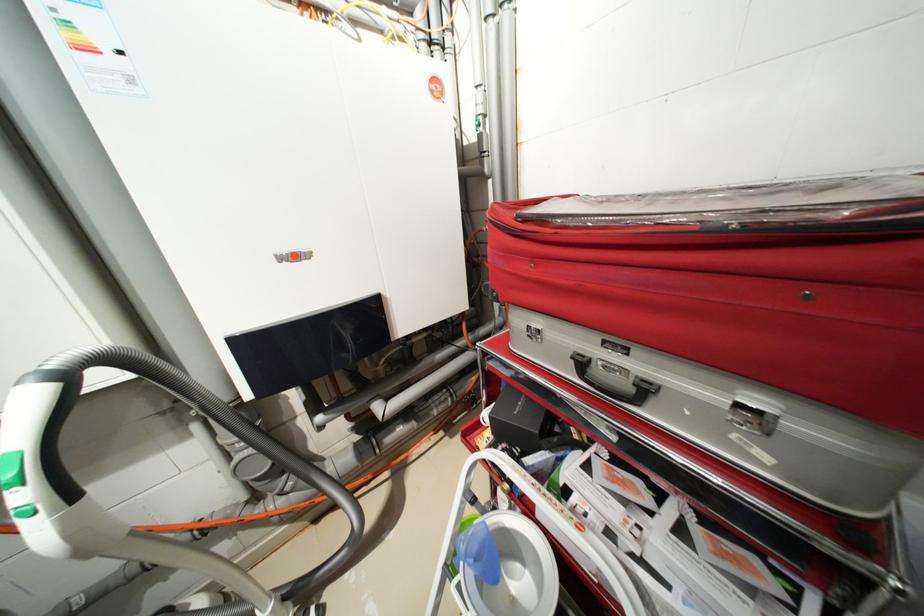
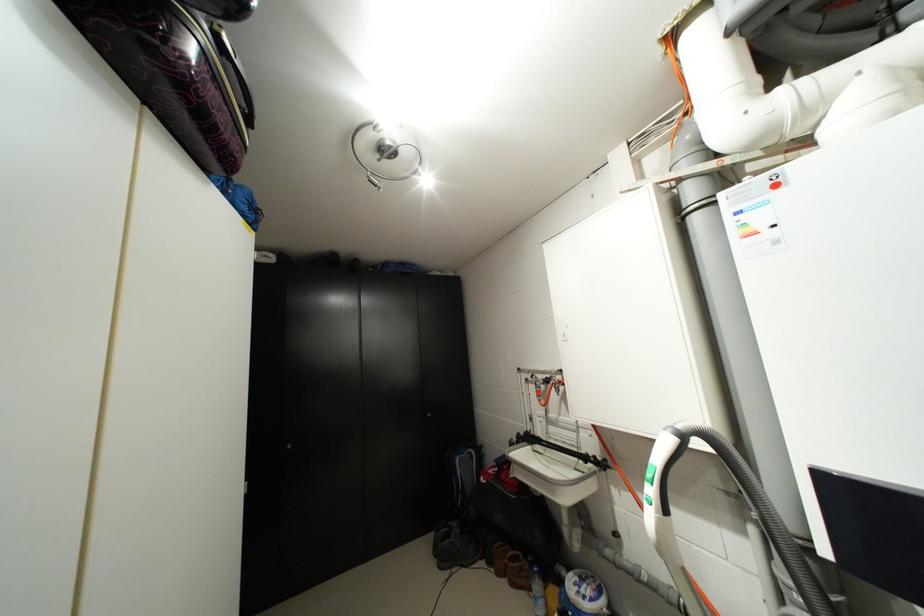
Locate, in the second image, the point that corresponds to (40,379) in the first image.

(676, 431)